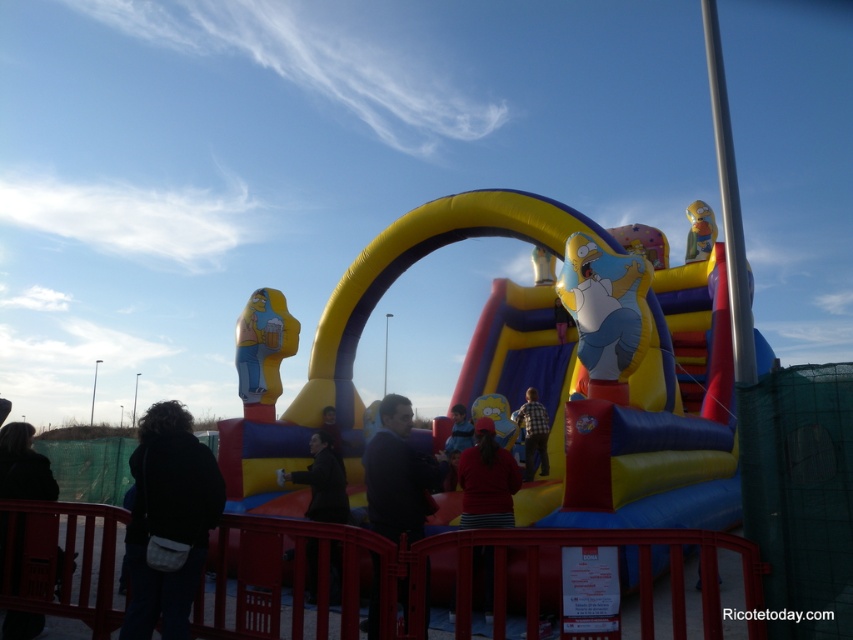
Between dark brown leather jacket at center and yellow rubber homer simpson at upper center, which one is positioned lower?

dark brown leather jacket at center

Between dark brown leather jacket at center and yellow rubber homer simpson at upper center, which one has more height?

yellow rubber homer simpson at upper center is taller.

What do you see at coordinates (322, 481) in the screenshot? I see `dark brown leather jacket at center` at bounding box center [322, 481].

Identify the location of dark brown leather jacket at center. The image size is (853, 640). (322, 481).

Is matte red shirt at center above yellow rubber homer simpson at upper center?

No.

Can you confirm if matte red shirt at center is positioned to the right of yellow rubber homer simpson at upper center?

No, matte red shirt at center is not to the right of yellow rubber homer simpson at upper center.

Where is `matte red shirt at center`? matte red shirt at center is located at coordinates (486, 481).

Identify the location of matte red shirt at center. This screenshot has width=853, height=640. (486, 481).

Does yellow matte homer simpson at left have a larger size compared to inflatable yellow at center?

Indeed, yellow matte homer simpson at left has a larger size compared to inflatable yellow at center.

This screenshot has width=853, height=640. Describe the element at coordinates (262, 349) in the screenshot. I see `yellow matte homer simpson at left` at that location.

You are a GUI agent. You are given a task and a screenshot of the screen. Output one action in this format:
    pyautogui.click(x=<x>, y=<y>)
    Task: Click on the yellow matte homer simpson at left
    The image size is (853, 640).
    Given the screenshot: What is the action you would take?
    pyautogui.click(x=262, y=349)